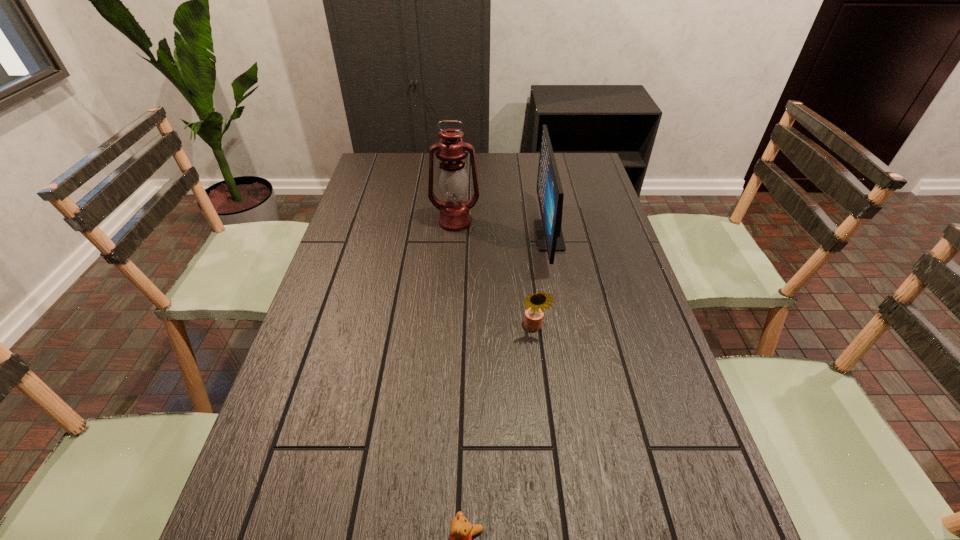
At what (x,y) coordinates should I click in order to perform the action: click on the tallest object. Please return your answer as a coordinate pair (x, y). The image size is (960, 540). Looking at the image, I should click on (452, 179).

The width and height of the screenshot is (960, 540). I want to click on the rightmost object, so [x=550, y=193].

This screenshot has width=960, height=540. Find the location of `the third shortest object`. the third shortest object is located at coordinates (550, 193).

Identify the location of sunflower. (535, 303).

Locate an element on the screen. the second shortest object is located at coordinates (535, 303).

You are a GUI agent. You are given a task and a screenshot of the screen. Output one action in this format:
    pyautogui.click(x=<x>, y=<y>)
    Task: Click on the vacant area situated on the right of the tallest object
    The width and height of the screenshot is (960, 540).
    Given the screenshot: What is the action you would take?
    pyautogui.click(x=560, y=222)

You are a GUI agent. You are given a task and a screenshot of the screen. Output one action in this format:
    pyautogui.click(x=<x>, y=<y>)
    Task: Click on the vacant region located 0.250m on the screen side of the second tallest object
    The width and height of the screenshot is (960, 540).
    Given the screenshot: What is the action you would take?
    pyautogui.click(x=459, y=235)

The height and width of the screenshot is (540, 960). In order to click on free space located 0.370m on the screen side of the second tallest object in this screenshot , I will do `click(422, 235)`.

Locate an element on the screen. blank area located on the screen side of the second tallest object is located at coordinates (481, 235).

The height and width of the screenshot is (540, 960). I want to click on free space located 0.290m on the face of the sunflower, so click(547, 448).